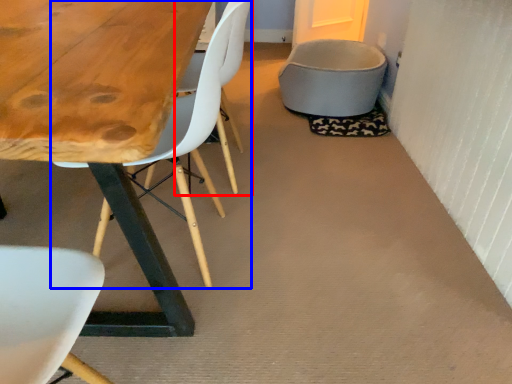
Question: Which of the following is the closest to the observer, armchair (highlighted by a red box) or chair (highlighted by a blue box)?

Choices:
 (A) armchair
 (B) chair

Answer: (B)